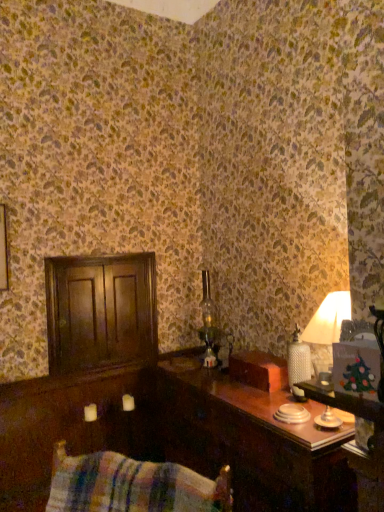
What is the approximate width of dark wood dresser at left?

dark wood dresser at left is 2.23 inches wide.

This screenshot has width=384, height=512. Find the location of `dark wood dresser at left`. dark wood dresser at left is located at coordinates (100, 311).

What do you see at coordinates (249, 441) in the screenshot?
I see `wooden table at right` at bounding box center [249, 441].

Where is `dark wood dresser at left`? The height and width of the screenshot is (512, 384). dark wood dresser at left is located at coordinates (100, 311).

Considering the sizes of objects wooden table at right and dark wood dresser at left in the image provided, who is smaller, wooden table at right or dark wood dresser at left?

With smaller size is dark wood dresser at left.

Which object is thinner, wooden table at right or dark wood dresser at left?

Thinner between the two is dark wood dresser at left.

Is dark wood dresser at left inside wooden table at right?

Definitely not — dark wood dresser at left is not inside wooden table at right.

Does wooden table at right have a greater height compared to dark wood dresser at left?

Yes, wooden table at right is taller than dark wood dresser at left.

Consider the image. Is wooden table at right next to plaid fabric swivel chair at lower left and touching it?

No, wooden table at right is not next to plaid fabric swivel chair at lower left.

Considering the positions of objects wooden table at right and plaid fabric swivel chair at lower left in the image provided, who is more to the right, wooden table at right or plaid fabric swivel chair at lower left?

wooden table at right.

Can we say wooden table at right lies outside plaid fabric swivel chair at lower left?

Yes, wooden table at right is not within plaid fabric swivel chair at lower left.

How different are the orientations of wooden table at right and plaid fabric swivel chair at lower left in degrees?

41.5 degrees separate the facing orientations of wooden table at right and plaid fabric swivel chair at lower left.

Is dark wood dresser at left completely or partially outside of plaid fabric swivel chair at lower left?

That's correct, dark wood dresser at left is outside of plaid fabric swivel chair at lower left.

Where is `swivel chair on the right side of dark wood dresser at left`? The height and width of the screenshot is (512, 384). swivel chair on the right side of dark wood dresser at left is located at coordinates (132, 485).

Is dark wood dresser at left at the right side of plaid fabric swivel chair at lower left?

Answer: Incorrect, dark wood dresser at left is not on the right side of plaid fabric swivel chair at lower left.

Is dark wood dresser at left taller than plaid fabric swivel chair at lower left?

Yes.

Which is closer, (197, 507) or (61, 310)?

The point (197, 507) is in front.

Considering the sizes of objects plaid fabric swivel chair at lower left and dark wood dresser at left in the image provided, who is bigger, plaid fabric swivel chair at lower left or dark wood dresser at left?

With larger size is plaid fabric swivel chair at lower left.

Considering the sizes of objects plaid fabric swivel chair at lower left and dark wood dresser at left in the image provided, who is thinner, plaid fabric swivel chair at lower left or dark wood dresser at left?

Thinner between the two is dark wood dresser at left.

Which object is wider, dark wood dresser at left or wooden table at right?

Wider between the two is wooden table at right.

I want to click on table in front of the dark wood dresser at left, so click(x=249, y=441).

Is dark wood dresser at left bigger than wooden table at right?

Actually, dark wood dresser at left might be smaller than wooden table at right.

What's the angular difference between dark wood dresser at left and wooden table at right's facing directions?

The facing directions of dark wood dresser at left and wooden table at right are 91.8 degrees apart.

Locate an element on the screen. This screenshot has width=384, height=512. table on the right of plaid fabric swivel chair at lower left is located at coordinates (249, 441).

From a real-world perspective, is plaid fabric swivel chair at lower left over wooden table at right?

Yes, from a real-world perspective, plaid fabric swivel chair at lower left is on top of wooden table at right.

Is plaid fabric swivel chair at lower left beside wooden table at right?

plaid fabric swivel chair at lower left is not next to wooden table at right, and they're not touching.

Where is `dresser to the left of wooden table at right`? The height and width of the screenshot is (512, 384). dresser to the left of wooden table at right is located at coordinates (100, 311).

Where is `swivel chair that is in front of the wooden table at right`? The width and height of the screenshot is (384, 512). swivel chair that is in front of the wooden table at right is located at coordinates (132, 485).

Estimate the real-world distances between objects in this image. Which object is further from dark wood dresser at left, plaid fabric swivel chair at lower left or wooden table at right?

Based on the image, plaid fabric swivel chair at lower left appears to be further to dark wood dresser at left.

From the image, which object appears to be nearer to dark wood dresser at left, wooden table at right or plaid fabric swivel chair at lower left?

Based on the image, wooden table at right appears to be nearer to dark wood dresser at left.

Based on the photo, from the image, which object appears to be nearer to wooden table at right, dark wood dresser at left or plaid fabric swivel chair at lower left?

Based on the image, dark wood dresser at left appears to be nearer to wooden table at right.

Estimate the real-world distances between objects in this image. Which object is further from plaid fabric swivel chair at lower left, dark wood dresser at left or wooden table at right?

dark wood dresser at left lies further to plaid fabric swivel chair at lower left than the other object.

From the picture: Considering their positions, is plaid fabric swivel chair at lower left positioned closer to wooden table at right than dark wood dresser at left?

dark wood dresser at left is positioned closer to the anchor wooden table at right.

Considering their positions, is wooden table at right positioned further to plaid fabric swivel chair at lower left than dark wood dresser at left?

Based on the image, dark wood dresser at left appears to be further to plaid fabric swivel chair at lower left.

Where is `table located between plaid fabric swivel chair at lower left and dark wood dresser at left in the depth direction`? table located between plaid fabric swivel chair at lower left and dark wood dresser at left in the depth direction is located at coordinates (249, 441).